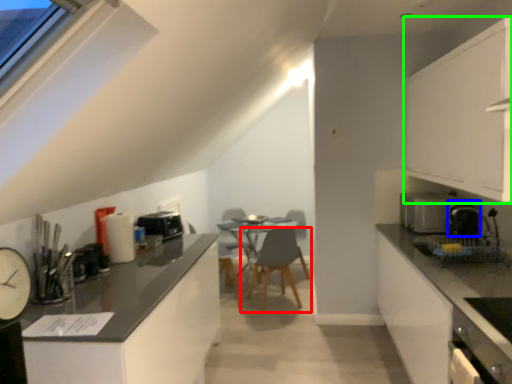
Question: Considering the real-world distances, which object is farthest from chair (highlighted by a red box)? appliance (highlighted by a blue box) or cabinetry (highlighted by a green box)?

Choices:
 (A) appliance
 (B) cabinetry

Answer: (B)